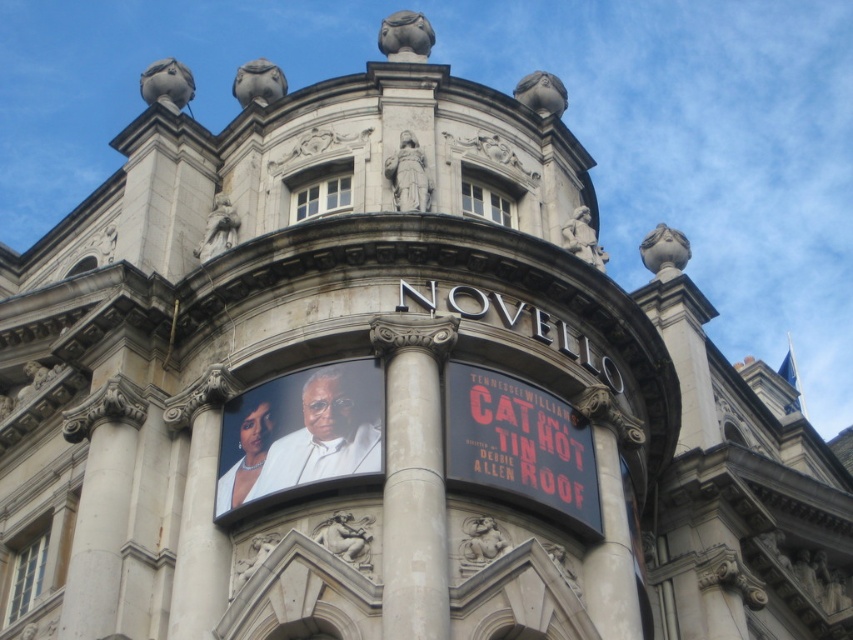
You are standing 40 meters away from a grand classical building. You want to take a photo of the white stone column at center. Is the column within your camera lens range if the minimum focusing distance is 30 meters?

The white stone column at center is 39.02 meters away from the viewer. Since the minimum focusing distance is 30 meters, the column is within the camera lens range as it is closer than the minimum focusing distance requirement.

You are standing in front of the grand classical building and want to take a photo of the NOVELLO advertisement without the white stone column at center blocking the view. Where should you position yourself relative to the column to ensure it doesn not appear in your photo?

To avoid the white stone column at center blocking the view of the NOVELLO advertisement, position yourself to the left or right of the column, as it is located at point (413, 476), which means it is centrally positioned. By moving to either side, you can frame the advertisement without the column obstructing the shot.